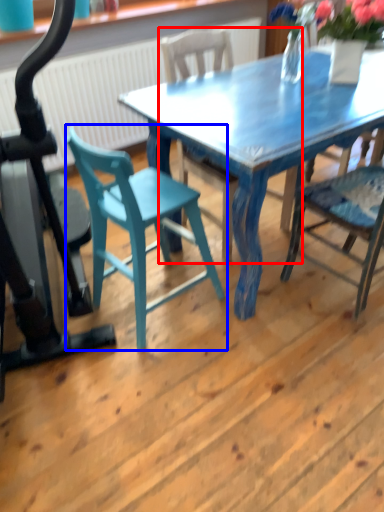
Question: Which object appears farthest to the camera in this image, chair (highlighted by a red box) or chair (highlighted by a blue box)?

Choices:
 (A) chair
 (B) chair

Answer: (A)